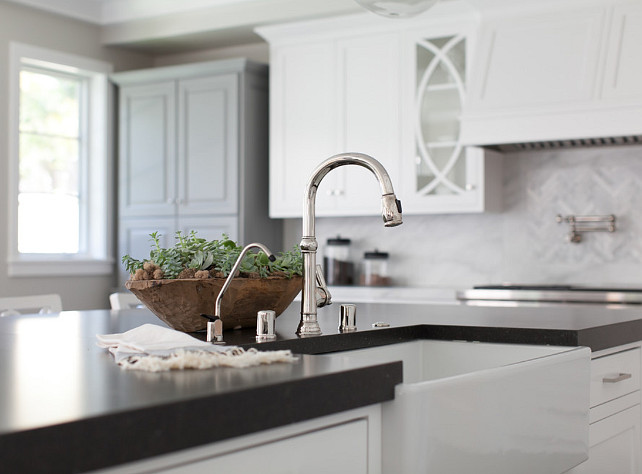
This screenshot has height=474, width=642. I want to click on cupboard drawer, so click(x=614, y=360).